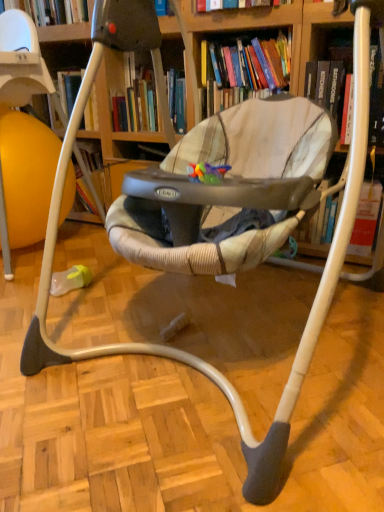
Question: Considering the positions of hardcover book at upper center, the first book viewed from the left, and wooden bookcase at center in the image, is hardcover book at upper center, the first book viewed from the left, taller or shorter than wooden bookcase at center?

Choices:
 (A) tall
 (B) short

Answer: (B)

Question: Considering the positions of point (226, 77) and point (19, 25), is point (226, 77) closer or farther from the camera than point (19, 25)?

Choices:
 (A) farther
 (B) closer

Answer: (B)

Question: Which object is positioned closest to the hardcover book at upper center, the second book in the right-to-left sequence?

Choices:
 (A) hardcover book at upper right, which appears as the 2th book when viewed from the left
 (B) wooden bookcase at center

Answer: (A)

Question: Which object is the closest to the hardcover book at upper right, placed as the first book when sorted from right to left?

Choices:
 (A) hardcover book at upper center, the first book viewed from the left
 (B) wooden bookcase at center

Answer: (A)